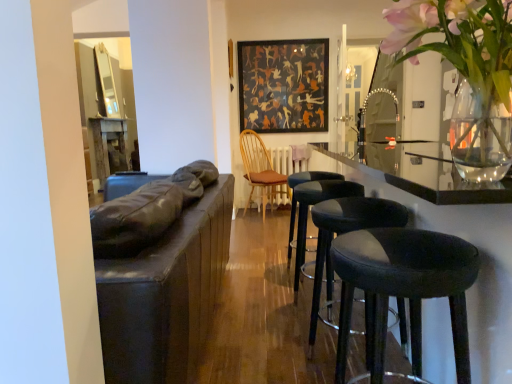
Measure the distance between black leather stool at center, marked as the 2th stool in a back-to-front arrangement, and camera.

The depth of black leather stool at center, marked as the 2th stool in a back-to-front arrangement, is 2.06 meters.

What do you see at coordinates (259, 168) in the screenshot?
I see `wooden spindles chair at center` at bounding box center [259, 168].

This screenshot has height=384, width=512. Find the location of `wooden spindles chair at center`. wooden spindles chair at center is located at coordinates (259, 168).

Identify the location of black leather stool at center, the 1th stool in the back-to-front sequence. (294, 196).

You are a GUI agent. You are given a task and a screenshot of the screen. Output one action in this format:
    pyautogui.click(x=<x>, y=<y>)
    Task: Click on the black leather stool at center, which ranks as the third stool in back-to-front order
    
    Given the screenshot: What is the action you would take?
    pyautogui.click(x=346, y=232)

This screenshot has height=384, width=512. What do you see at coordinates (283, 85) in the screenshot?
I see `dark matte painting at center` at bounding box center [283, 85].

What do you see at coordinates (447, 230) in the screenshot?
I see `black leather bar stools at right` at bounding box center [447, 230].

Find the location of a particular element. This screenshot has width=512, height=384. black leather stool at center, marked as the 2th stool in a back-to-front arrangement is located at coordinates (314, 204).

Is the depth of black leather stool at center, the fourth stool in the front-to-back sequence, less than that of dark matte painting at center?

Yes, black leather stool at center, the fourth stool in the front-to-back sequence, is closer to the viewer.

Is point (291, 237) positioned after point (247, 49)?

No, (291, 237) is in front of (247, 49).

Can we say black leather stool at center, the 1th stool in the back-to-front sequence, lies outside dark matte painting at center?

black leather stool at center, the 1th stool in the back-to-front sequence, is positioned outside dark matte painting at center.

In terms of size, does wooden spindles chair at center appear bigger or smaller than dark matte painting at center?

Clearly, wooden spindles chair at center is larger in size than dark matte painting at center.

Does point (261, 165) lie behind point (308, 98)?

Yes, it is behind point (308, 98).

From the image's perspective, is wooden spindles chair at center located above or below dark matte painting at center?

From the image's perspective, wooden spindles chair at center appears below dark matte painting at center.

Which point is more forward, (381, 145) or (307, 202)?

Point (307, 202)

Which of these two, black leather bar stools at right or black leather stool at center, marked as the 2th stool in a back-to-front arrangement, is thinner?

With smaller width is black leather stool at center, marked as the 2th stool in a back-to-front arrangement.

Is black leather bar stools at right facing towards black leather stool at center, marked as the 2th stool in a back-to-front arrangement?

Yes, black leather bar stools at right is turned towards black leather stool at center, marked as the 2th stool in a back-to-front arrangement.

From the image's perspective, is black leather bar stools at right positioned above or below black leather stool at center, marked as the 2th stool in a back-to-front arrangement?

Clearly, from the image's perspective, black leather bar stools at right is above black leather stool at center, marked as the 2th stool in a back-to-front arrangement.

How many degrees apart are the facing directions of black leather stool at center, the fourth stool in the front-to-back sequence, and clear glass vase at upper right?

→ 180 degrees.

Which stool is the 2nd one when counting from the left side of the clear glass vase at upper right? Please provide its 2D coordinates.

[(294, 196)]

From a real-world perspective, is black leather stool at center, the fourth stool in the front-to-back sequence, positioned over clear glass vase at upper right based on gravity?

Incorrect, from a real-world perspective, black leather stool at center, the fourth stool in the front-to-back sequence, is lower than clear glass vase at upper right.

From the picture: Is black leather stool at center, the fourth stool in the front-to-back sequence, facing towards clear glass vase at upper right?

No, black leather stool at center, the fourth stool in the front-to-back sequence, is not aimed at clear glass vase at upper right.

Which point is more distant from viewer, (x=307, y=174) or (x=478, y=316)?

The point (x=307, y=174) is farther from the camera.

Is black leather stool at center, the 1th stool in the back-to-front sequence, far from black leather bar stools at right?

Actually, black leather stool at center, the 1th stool in the back-to-front sequence, and black leather bar stools at right are a little close together.

Can black leather bar stools at right be found inside black leather stool at center, the 1th stool in the back-to-front sequence?

No, black leather bar stools at right is not inside black leather stool at center, the 1th stool in the back-to-front sequence.

Is black leather stool at center, marked as the 3th stool in a front-to-back arrangement, taller than black leather stool at center, the second stool when ordered from front to back?

No.

Measure the distance between black leather stool at center, marked as the 3th stool in a front-to-back arrangement, and black leather stool at center, the second stool when ordered from front to back.

black leather stool at center, marked as the 3th stool in a front-to-back arrangement, is 48.72 centimeters from black leather stool at center, the second stool when ordered from front to back.

Is black leather stool at center, marked as the 3th stool in a front-to-back arrangement, outside of black leather stool at center, which ranks as the third stool in back-to-front order?

That's correct, black leather stool at center, marked as the 3th stool in a front-to-back arrangement, is outside of black leather stool at center, which ranks as the third stool in back-to-front order.

Considering the sizes of black leather stool at center, marked as the 2th stool in a back-to-front arrangement, and black leather stool at center, which ranks as the third stool in back-to-front order, in the image, is black leather stool at center, marked as the 2th stool in a back-to-front arrangement, bigger or smaller than black leather stool at center, which ranks as the third stool in back-to-front order,?

black leather stool at center, marked as the 2th stool in a back-to-front arrangement, is bigger than black leather stool at center, which ranks as the third stool in back-to-front order.

Where is `the 4th stool to the right of the matte black table at center, starting your count from the anchor`? The height and width of the screenshot is (384, 512). the 4th stool to the right of the matte black table at center, starting your count from the anchor is located at coordinates (346, 232).

Which object is wider, black leather stool at center, which ranks as the third stool in back-to-front order, or matte black table at center?

matte black table at center is wider.

Can you confirm if black leather stool at center, the second stool when ordered from front to back, is smaller than matte black table at center?

Indeed, black leather stool at center, the second stool when ordered from front to back, has a smaller size compared to matte black table at center.

Which object is more forward, black leather stool at center, which ranks as the third stool in back-to-front order, or matte black table at center?

black leather stool at center, which ranks as the third stool in back-to-front order, is in front.

From the image's perspective, starting from the dark matte painting at center, which stool is the 1st one below? Please provide its 2D coordinates.

[(294, 196)]

Identify the location of chair in front of the dark matte painting at center. (259, 168).

Which object lies further to the anchor point matte black table at center, black leather stool at lower right, marked as the 4th stool in a back-to-front arrangement, or black leather stool at center, marked as the 3th stool in a front-to-back arrangement?

Based on the image, black leather stool at lower right, marked as the 4th stool in a back-to-front arrangement, appears to be further to matte black table at center.

Considering their positions, is wooden spindles chair at center positioned closer to matte black table at center than black leather bar stools at right?

The object closer to matte black table at center is wooden spindles chair at center.

Consider the image. From the image, which object appears to be nearer to wooden spindles chair at center, black leather stool at center, marked as the 3th stool in a front-to-back arrangement, or matte black table at center?

matte black table at center.

Estimate the real-world distances between objects in this image. Which object is closer to black leather stool at center, the 1th stool in the back-to-front sequence, wooden spindles chair at center or black leather stool at center, the second stool when ordered from front to back?

black leather stool at center, the second stool when ordered from front to back.

When comparing their distances from wooden spindles chair at center, does black leather stool at lower right, which is counted as the first stool, starting from the front, or black leather bar stools at right seem further?

black leather stool at lower right, which is counted as the first stool, starting from the front, is positioned further to the anchor wooden spindles chair at center.

Based on their spatial positions, is matte black table at center or black leather stool at lower right, marked as the 4th stool in a back-to-front arrangement, closer to black leather stool at center, the 1th stool in the back-to-front sequence?

black leather stool at lower right, marked as the 4th stool in a back-to-front arrangement, lies closer to black leather stool at center, the 1th stool in the back-to-front sequence, than the other object.

When comparing their distances from wooden spindles chair at center, does black leather stool at center, the 1th stool in the back-to-front sequence, or black leather stool at lower right, marked as the 4th stool in a back-to-front arrangement, seem further?

The object further to wooden spindles chair at center is black leather stool at lower right, marked as the 4th stool in a back-to-front arrangement.

When comparing their distances from black leather stool at lower right, marked as the 4th stool in a back-to-front arrangement, does black leather stool at center, the second stool when ordered from front to back, or dark matte painting at center seem closer?

black leather stool at center, the second stool when ordered from front to back.

Where is `counter top between clear glass vase at upper right and wooden spindles chair at center in the front-back direction`? Image resolution: width=512 pixels, height=384 pixels. counter top between clear glass vase at upper right and wooden spindles chair at center in the front-back direction is located at coordinates (447, 230).

This screenshot has height=384, width=512. I want to click on chair between black leather stool at center, marked as the 2th stool in a back-to-front arrangement, and matte black table at center from front to back, so (x=259, y=168).

The height and width of the screenshot is (384, 512). Identify the location of chair between black leather stool at lower right, which is counted as the first stool, starting from the front, and matte black table at center, along the z-axis. (259, 168).

Where is `stool positioned between black leather stool at lower right, which is counted as the first stool, starting from the front, and black leather stool at center, marked as the 2th stool in a back-to-front arrangement, from near to far`? This screenshot has height=384, width=512. stool positioned between black leather stool at lower right, which is counted as the first stool, starting from the front, and black leather stool at center, marked as the 2th stool in a back-to-front arrangement, from near to far is located at coordinates (346, 232).